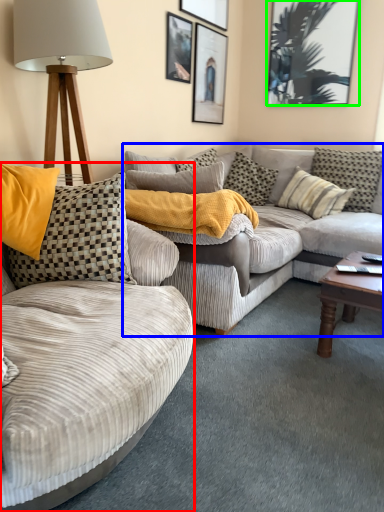
Question: Estimate the real-world distances between objects in this image. Which object is farther from studio couch (highlighted by a red box), studio couch (highlighted by a blue box) or picture frame (highlighted by a green box)?

Choices:
 (A) studio couch
 (B) picture frame

Answer: (B)